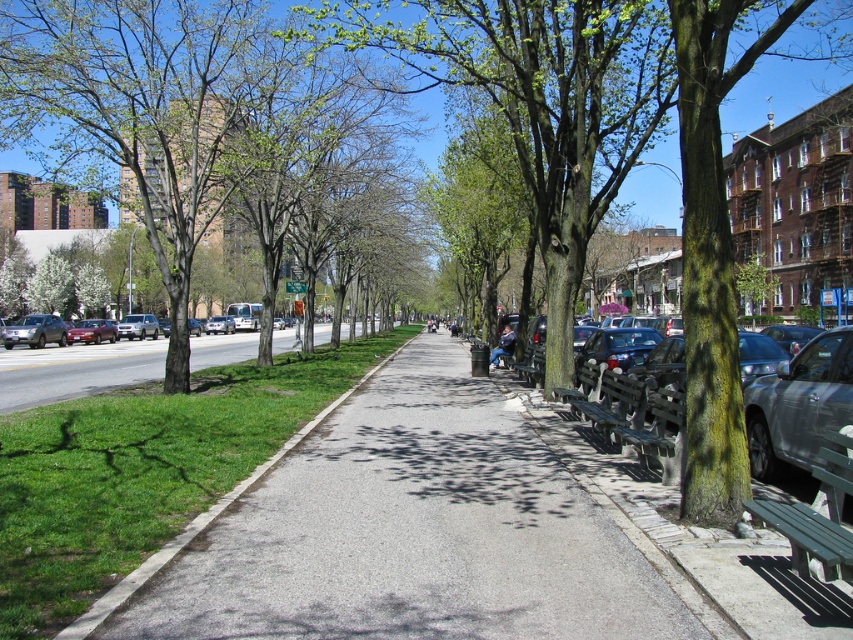
Question: Is green leafy tree at left above matte red sedan at left?

Choices:
 (A) no
 (B) yes

Answer: (B)

Question: Which of the following is the closest to the observer?

Choices:
 (A) (552, 273)
 (B) (677, 465)

Answer: (B)

Question: Is metallic silver bench at right below matte red sedan at left?

Choices:
 (A) no
 (B) yes

Answer: (B)

Question: Does gray asphalt pavement at center have a greater width compared to wooden park bench at right?

Choices:
 (A) yes
 (B) no

Answer: (A)

Question: Which point is closer to the camera?

Choices:
 (A) (50, 314)
 (B) (67, 77)
 (C) (762, 419)

Answer: (C)

Question: Which is nearer to the green bark tree at center?

Choices:
 (A) silver metallic sedan at left
 (B) matte black car at left

Answer: (B)